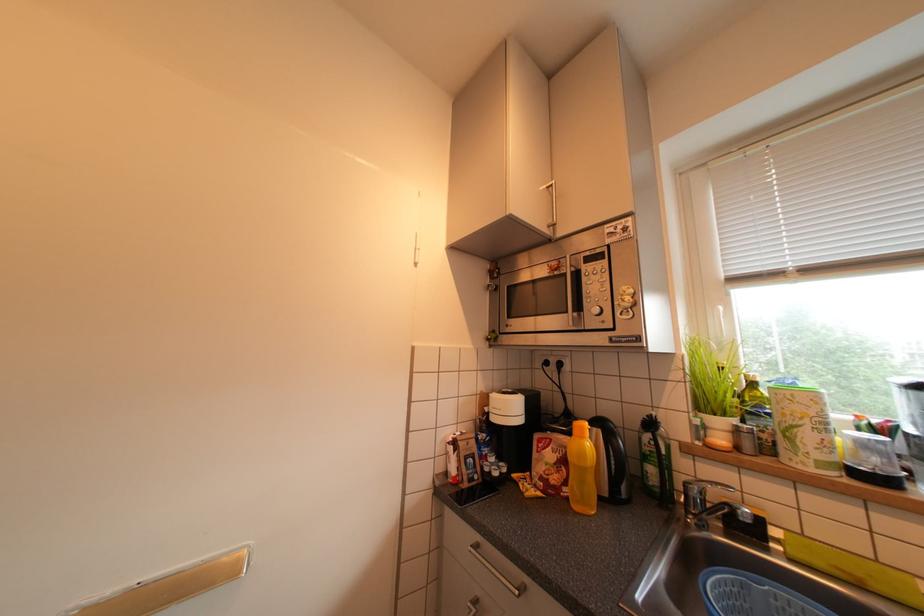
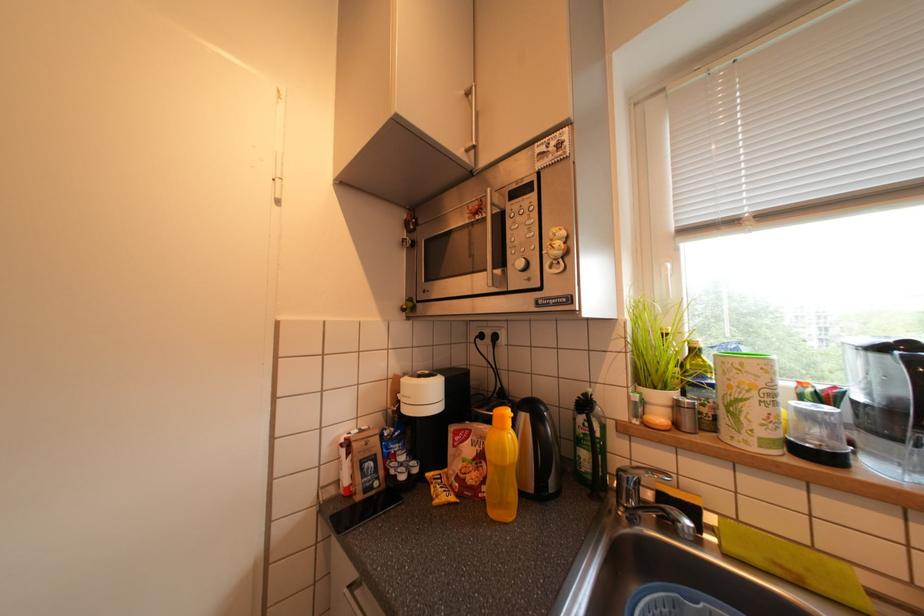
Question: The first image is from the beginning of the video and the second image is from the end. How did the camera likely rotate when shooting the video?

Choices:
 (A) Left
 (B) Right
 (C) Up
 (D) Down

Answer: (B)